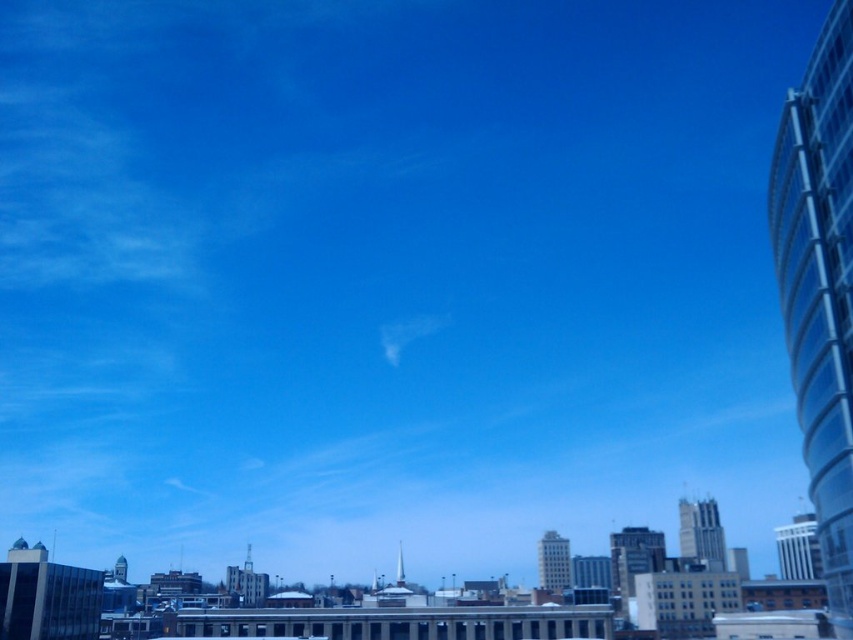
Is point (842, 272) farther from camera compared to point (640, 554)?

No, it is not.

In order to click on transparent glass tower at right in this screenshot , I will do `click(820, 288)`.

Looking at this image, does transparent glass tower at right have a greater width compared to gray concrete tower at lower center?

Yes.

Is point (804, 230) positioned behind point (254, 604)?

No, (804, 230) is in front of (254, 604).

This screenshot has width=853, height=640. I want to click on transparent glass tower at right, so click(x=820, y=288).

What do you see at coordinates (701, 532) in the screenshot?
I see `smooth glass skyscraper at center` at bounding box center [701, 532].

Who is positioned more to the left, smooth glass skyscraper at center or dark gray glass building at center?

dark gray glass building at center is more to the left.

Is point (699, 512) less distant than point (648, 545)?

No, it is not.

Where is `smooth glass skyscraper at center`? The image size is (853, 640). smooth glass skyscraper at center is located at coordinates (701, 532).